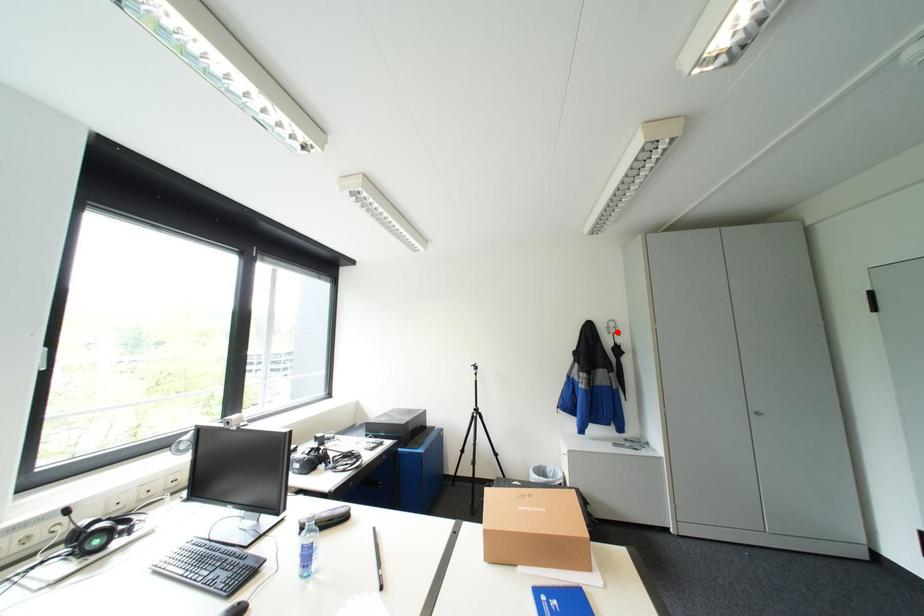
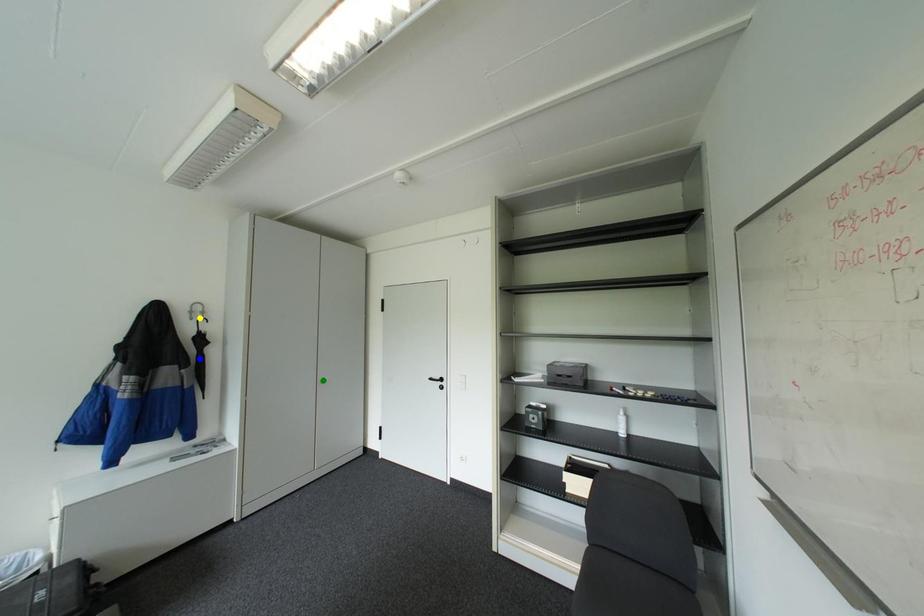
Question: I am providing you with two images of the same scene from different viewpoints. A red point is marked on the first image. You are given multiple points on the second image. Which mark in image 2 goes with the point in image 1?

Choices:
 (A) yellow point
 (B) blue point
 (C) green point

Answer: (A)